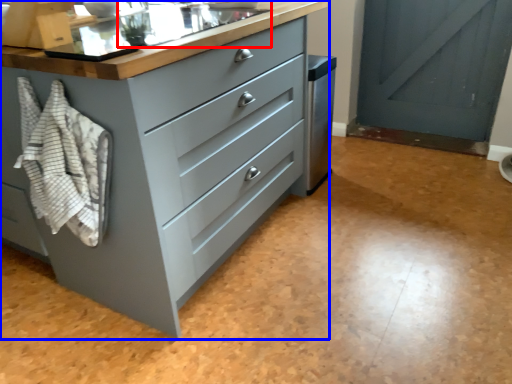
Question: Which object is closer to the camera taking this photo, sink (highlighted by a red box) or chest of drawers (highlighted by a blue box)?

Choices:
 (A) sink
 (B) chest of drawers

Answer: (B)